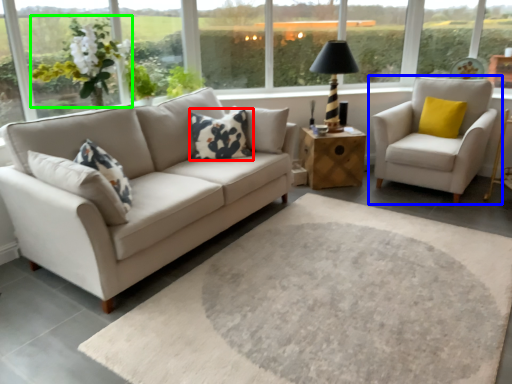
Question: Which object is the closest to the pillow (highlighted by a red box)? Choose among these: chair (highlighted by a blue box) or flower (highlighted by a green box).

Choices:
 (A) chair
 (B) flower

Answer: (B)